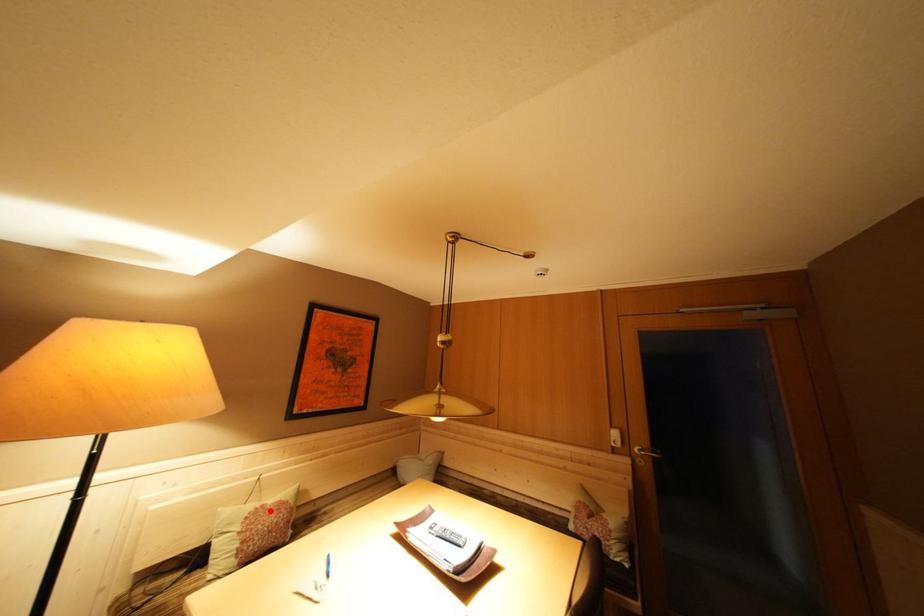
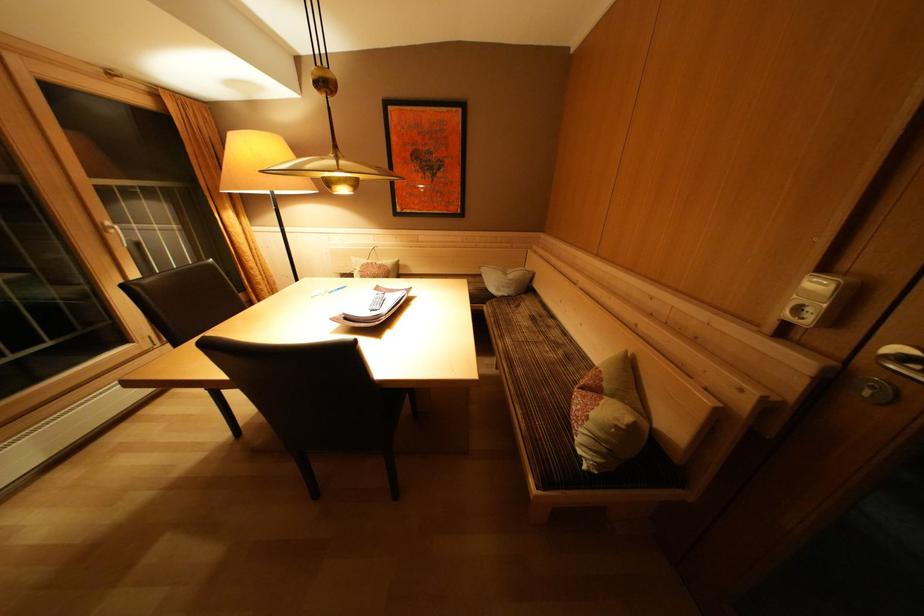
Find the pixel in the second image that matches the highlighted location in the first image.

(379, 268)